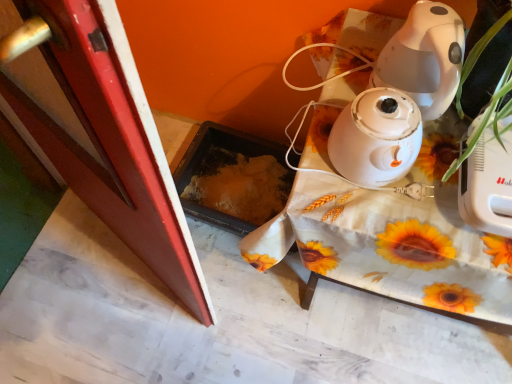
You are a GUI agent. You are given a task and a screenshot of the screen. Output one action in this format:
    pyautogui.click(x=<x>, y=<y>)
    Task: Click on the vacant space to the left of smooth red screen door at left
    
    Given the screenshot: What is the action you would take?
    pyautogui.click(x=67, y=277)